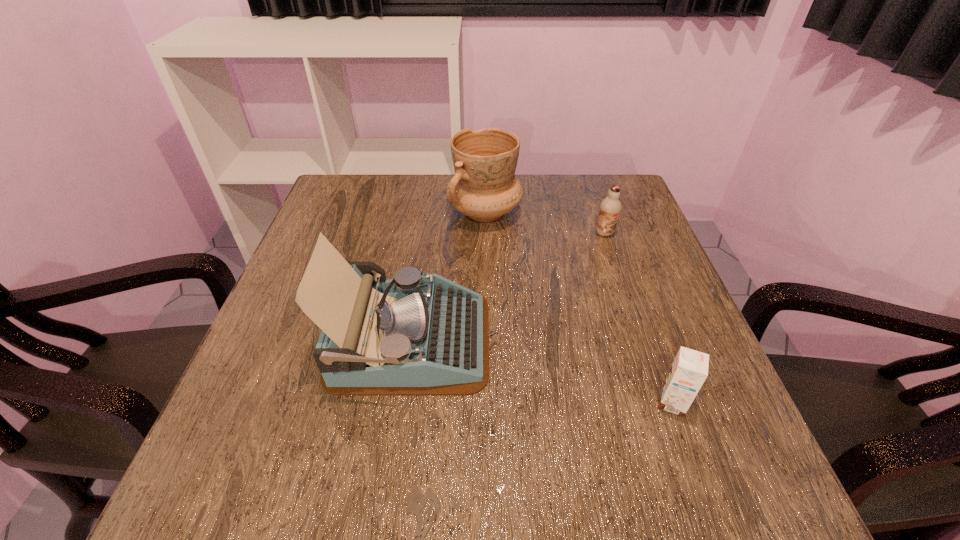
The height and width of the screenshot is (540, 960). I want to click on pottery, so click(x=484, y=187).

Locate an element on the screen. This screenshot has height=540, width=960. typewriter is located at coordinates click(x=418, y=334).

Image resolution: width=960 pixels, height=540 pixels. What are the coordinates of `the farther chocolate milk` in the screenshot? It's located at (610, 207).

In order to click on the nearer chocolate milk in this screenshot , I will do `click(689, 370)`.

At what (x,y) coordinates should I click in order to perform the action: click on blank area located on the right of the pottery. Please return your answer as a coordinate pair (x, y). This screenshot has height=540, width=960. Looking at the image, I should click on click(610, 212).

Identify the location of vacant space located 0.370m on the typing side of the typewriter. The image size is (960, 540). (676, 340).

Locate an element on the screen. free space located 0.080m on the back of the farther chocolate milk is located at coordinates (596, 210).

The height and width of the screenshot is (540, 960). Find the location of `free point located 0.120m on the left of the nearer chocolate milk`. free point located 0.120m on the left of the nearer chocolate milk is located at coordinates (588, 403).

Identify the location of object situated at the far edge. (484, 187).

Where is `object located at the left edge`? The height and width of the screenshot is (540, 960). object located at the left edge is located at coordinates (418, 334).